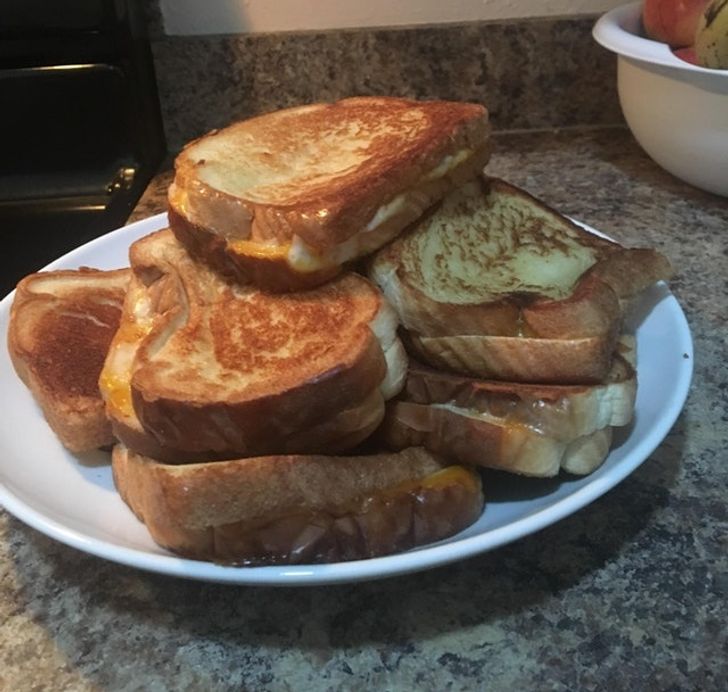
Where is `plate`? plate is located at coordinates (525, 520).